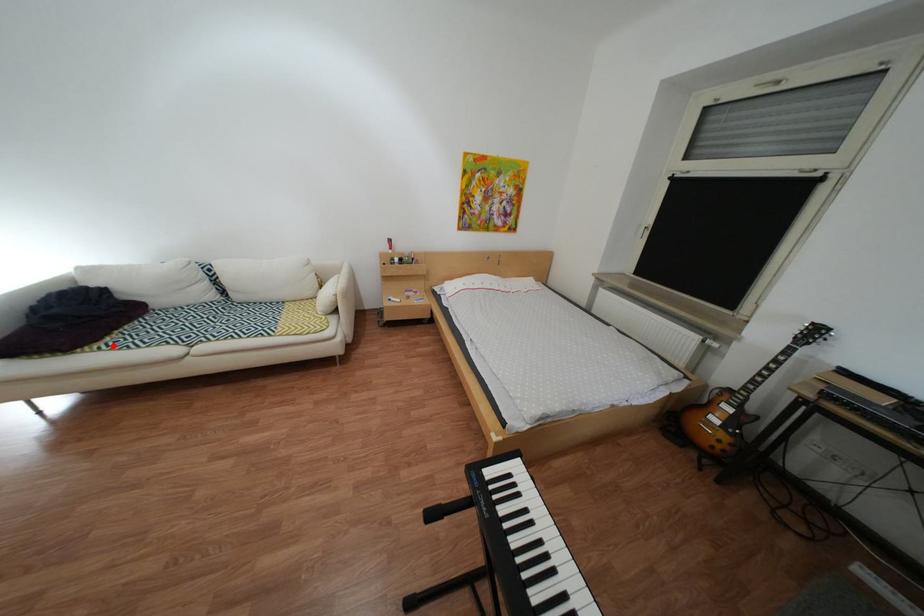
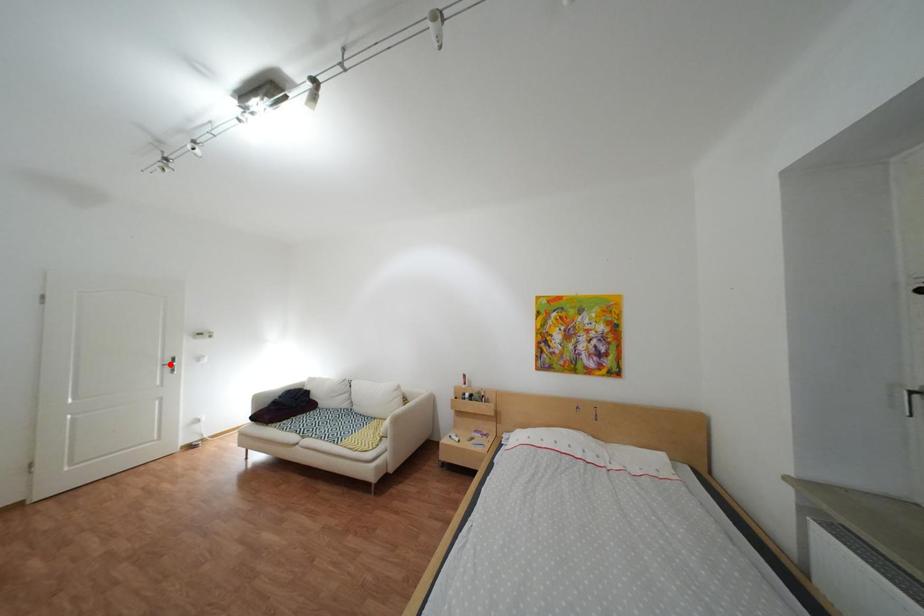
I am providing you with two images of the same scene from different viewpoints. A red point is marked on the first image and another point is marked on the second image. Are the points marked in image1 and image2 representing the same 3D position?

No